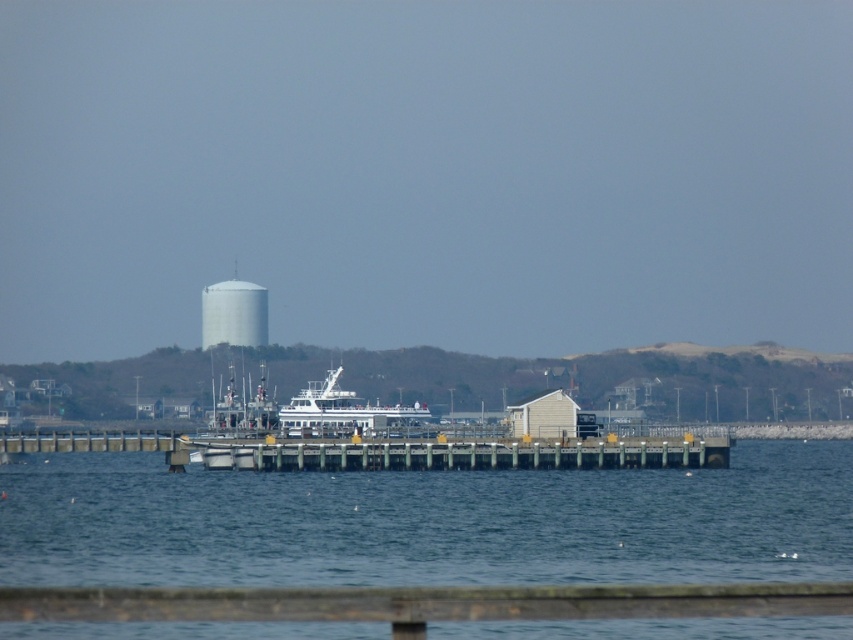
Question: Is blue water at center above wooden dock at center?

Choices:
 (A) no
 (B) yes

Answer: (A)

Question: Can you confirm if blue water at center is positioned below white matte water tower at center?

Choices:
 (A) yes
 (B) no

Answer: (A)

Question: Considering the relative positions of white matte ferry at center and white matte water tower at center in the image provided, where is white matte ferry at center located with respect to white matte water tower at center?

Choices:
 (A) below
 (B) above

Answer: (A)

Question: Which of the following is the closest to the observer?

Choices:
 (A) blue water at center
 (B) wooden dock at center
 (C) white matte water tower at center

Answer: (A)

Question: Which object appears closest to the camera in this image?

Choices:
 (A) white matte ferry at center
 (B) blue water at center
 (C) wooden dock at center

Answer: (B)

Question: Which object is the farthest from the white matte water tower at center?

Choices:
 (A) wooden dock at center
 (B) blue water at center
 (C) white matte ferry at center

Answer: (A)